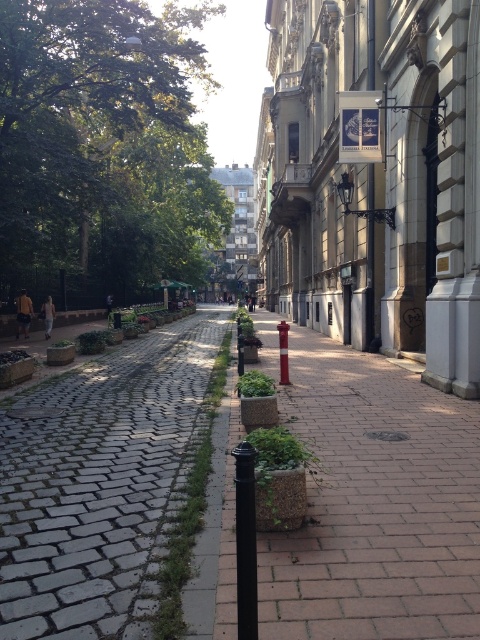
You are standing at the entrance of the street and want to locate the black matte pole at center. According to the coordinates given, where should you look relative to the street layout?

The black matte pole at center is located at the coordinates point (245,540), which would be towards the right side of the street closer to the ornate buildings since the x coordinate is closer to 1.0. The y coordinate 0.512 places it near the middle of the street from front to back.

You are a delivery person trying to determine the safest path for your heavy cart. You notice the brick pavement at center and the gray cobblestone pavement at left. Which pavement has a lower elevation that might be easier to navigate?

The brick pavement at center has a lesser height compared to the gray cobblestone pavement at left, so it has a lower elevation and would be easier to navigate.